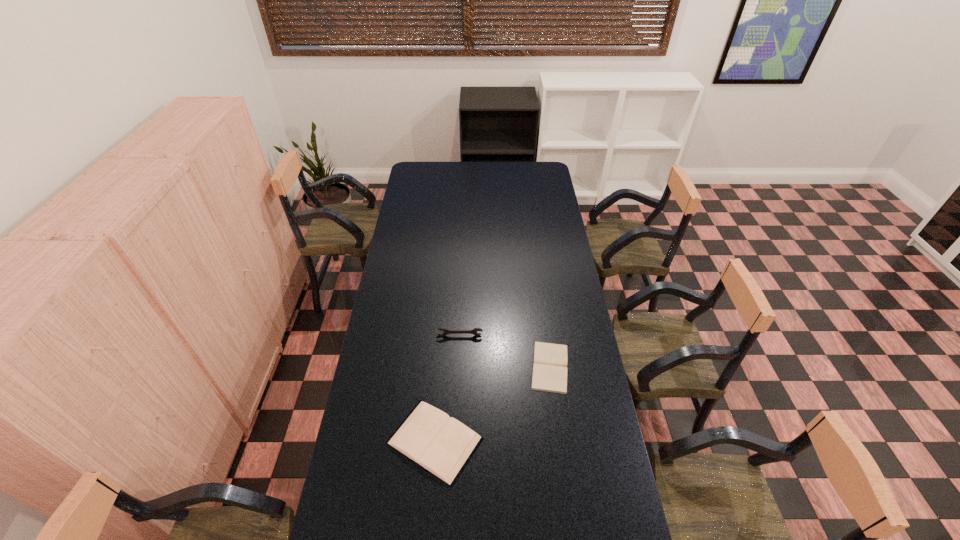
Identify the location of the tallest object. The image size is (960, 540). (446, 331).

Locate an element on the screen. This screenshot has width=960, height=540. wrench is located at coordinates (446, 331).

You are a GUI agent. You are given a task and a screenshot of the screen. Output one action in this format:
    pyautogui.click(x=<x>, y=<y>)
    Task: Click on the nearest object
    The image size is (960, 540).
    Given the screenshot: What is the action you would take?
    pyautogui.click(x=443, y=446)

The height and width of the screenshot is (540, 960). I want to click on hardback book, so click(443, 446).

This screenshot has height=540, width=960. Find the location of `the shortest object`. the shortest object is located at coordinates (549, 370).

The height and width of the screenshot is (540, 960). Identify the location of the rightmost object. (549, 370).

The height and width of the screenshot is (540, 960). I want to click on vacant area located 0.050m on the open ends of the tallest object, so click(459, 346).

Locate an element on the screen. The height and width of the screenshot is (540, 960). vacant space situated on the back of the second shortest object is located at coordinates (439, 388).

Locate an element on the screen. free space located on the front of the shortest object is located at coordinates (562, 454).

Identify the location of object that is at the left edge. The image size is (960, 540). (443, 446).